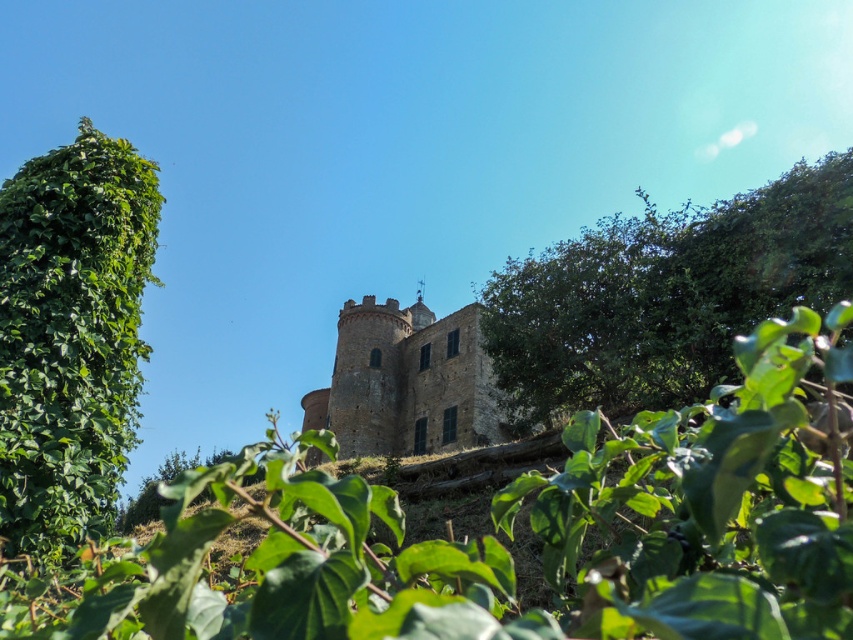
You are standing at the base of the historic stone castle and want to determine which of the two points, point [596,364] or point [53,428], is closer to you. Which point is nearer?

Point [596,364] is further to the viewer than point [53,428], so the closer point is point [53,428].

You are an architect analyzing the castle grounds. You need to determine if the green leafy tree at upper right will block the view of the brown stone castle at center from the main entrance. Based on their heights, can you predict whether the tree will obscure the castle?

The green leafy tree at upper right is taller than the brown stone castle at center. Since the tree is positioned at the upper right and is taller, it could potentially block the view of the castle from the main entrance depending on their exact positions and angles, but based solely on height, the tree being taller might obscure the castle.

You are standing at the base of the historic stone castle and want to reach the central tower. A point marked at coordinates point (579, 324) is 251.80 feet away from you. Can you estimate whether this point is closer to the central tower or the surrounding greenery?

The point marked at coordinates point (579, 324) is 251.80 feet from the viewer, so it is closer to the central tower than the surrounding greenery because the distance is within the castle structure.